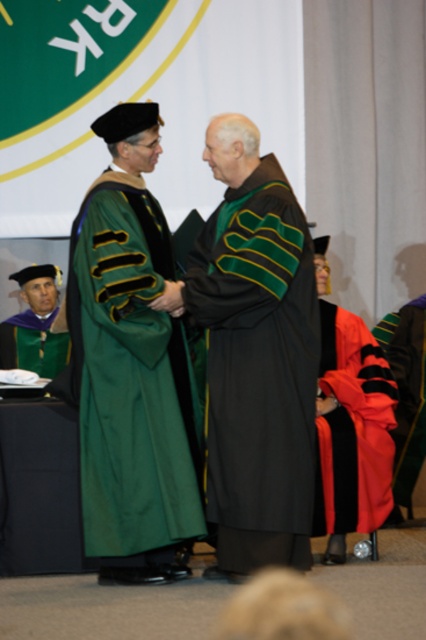
You are standing at the center of the ceremony and want to walk to both the point at coordinates point (273,368) and point (181,451). Which point should you reach first if you want to take the shortest path?

You should reach point (273,368) first because it is closer to you than point (181,451).

You are attending a graduation ceremony and notice two gowns in the scene. Which gown is positioned lower in the image, the black matte gown at center or the green matte graduation gown at lower left?

The black matte gown at center is positioned below the green matte graduation gown at lower left.

You are a photographer at the graduation ceremony. You need to capture a photo of both the black matte gown at center and the green matte graduation gown at left. Which gown should you focus on first to ensure it fits well in the frame?

The black matte gown at center is bigger than the green matte graduation gown at left, so you should focus on the black matte gown at center first to ensure it fits well in the frame.